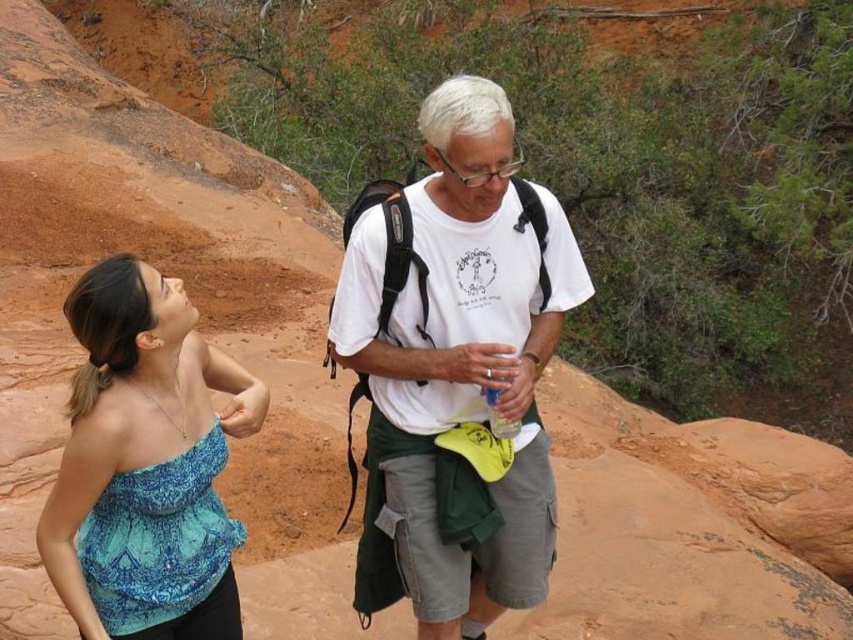
Is white cotton shirt at center taller than white cotton t-shirt at center?

No.

Is white cotton shirt at center in front of white cotton t-shirt at center?

Yes, white cotton shirt at center is closer to the viewer.

Does point (537, 188) come closer to viewer compared to point (422, 506)?

No, (537, 188) is behind (422, 506).

At what (x,y) coordinates should I click in order to perform the action: click on white cotton shirt at center. Please return your answer as a coordinate pair (x, y). The image size is (853, 640). Looking at the image, I should click on (462, 355).

The height and width of the screenshot is (640, 853). Describe the element at coordinates (456, 369) in the screenshot. I see `white cotton t-shirt at center` at that location.

Can you confirm if white cotton t-shirt at center is positioned to the left of blue printed fabric top at left?

No, white cotton t-shirt at center is not to the left of blue printed fabric top at left.

Is point (386, 496) farther from camera compared to point (219, 353)?

Yes.

Where is `white cotton t-shirt at center`? This screenshot has width=853, height=640. white cotton t-shirt at center is located at coordinates (456, 369).

Who is higher up, white cotton shirt at center or blue printed fabric top at left?

Positioned higher is white cotton shirt at center.

This screenshot has height=640, width=853. I want to click on white cotton shirt at center, so click(462, 355).